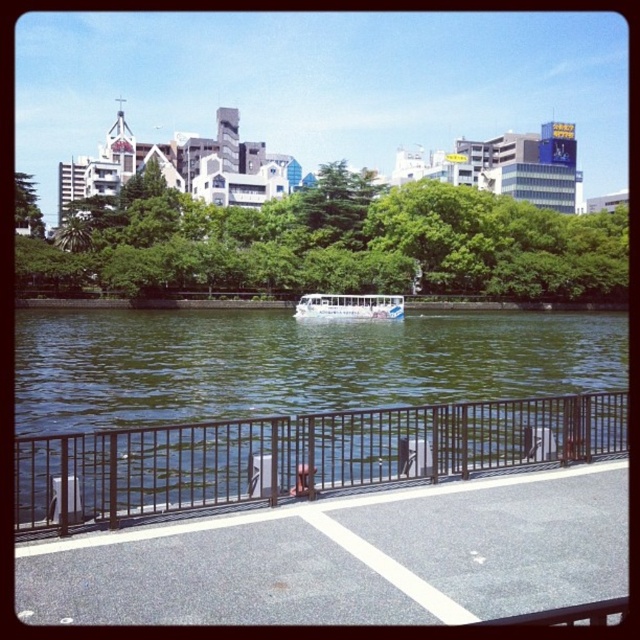
Does brown metal fence at lower center come behind white glossy boat at center?

No.

Between point (276, 424) and point (342, 316), which one is positioned behind?

Point (342, 316)

The height and width of the screenshot is (640, 640). I want to click on brown metal fence at lower center, so click(x=298, y=456).

This screenshot has height=640, width=640. What do you see at coordinates (340, 250) in the screenshot?
I see `green leafy tree at center` at bounding box center [340, 250].

Between point (317, 266) and point (384, 314), which one is positioned in front?

Point (384, 314)

Who is more distant from viewer, (481, 246) or (305, 307)?

The point (481, 246) is behind.

Image resolution: width=640 pixels, height=640 pixels. In order to click on green leafy tree at center in this screenshot , I will do `click(340, 250)`.

Can you confirm if green leafy tree at center is thinner than brown metal fence at lower center?

Incorrect, green leafy tree at center's width is not less than brown metal fence at lower center's.

Does green leafy tree at center come behind brown metal fence at lower center?

Yes, it is behind brown metal fence at lower center.

Is point (65, 275) closer to camera compared to point (275, 428)?

No.

Find the location of a particular element. green leafy tree at center is located at coordinates (340, 250).